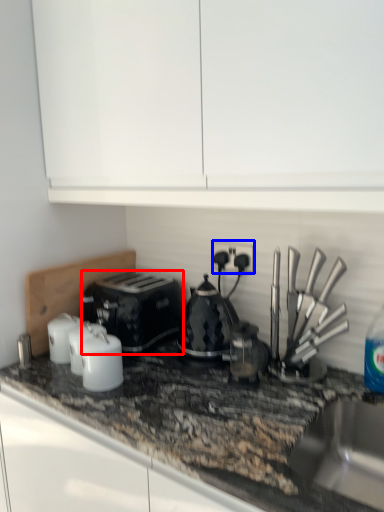
Question: Which object appears closest to the camera in this image, toaster (highlighted by a red box) or electric outlet (highlighted by a blue box)?

Choices:
 (A) toaster
 (B) electric outlet

Answer: (A)